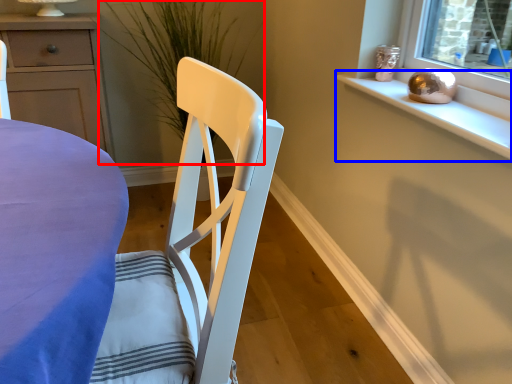
Question: Which object appears farthest to the camera in this image, plant (highlighted by a red box) or window sill (highlighted by a blue box)?

Choices:
 (A) plant
 (B) window sill

Answer: (A)